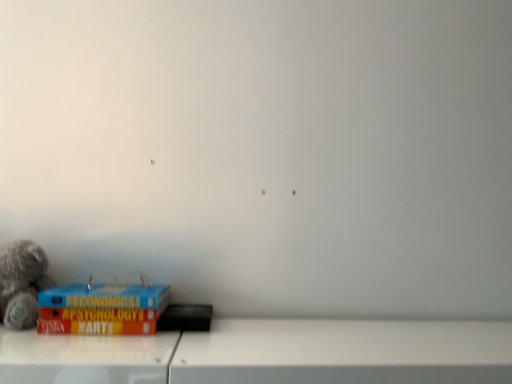
Question: Should I look upward or downward to see fluffy gray teddy bear at left?

Choices:
 (A) down
 (B) up

Answer: (A)

Question: Is fluffy gray teddy bear at left wider than blue hardcover book at lower left?

Choices:
 (A) no
 (B) yes

Answer: (A)

Question: Is fluffy gray teddy bear at left in front of blue hardcover book at lower left?

Choices:
 (A) yes
 (B) no

Answer: (B)

Question: Considering the relative positions of fluffy gray teddy bear at left and blue hardcover book at lower left in the image provided, is fluffy gray teddy bear at left behind blue hardcover book at lower left?

Choices:
 (A) yes
 (B) no

Answer: (A)

Question: Considering the relative sizes of fluffy gray teddy bear at left and blue hardcover book at lower left in the image provided, is fluffy gray teddy bear at left smaller than blue hardcover book at lower left?

Choices:
 (A) yes
 (B) no

Answer: (A)

Question: Considering the relative sizes of fluffy gray teddy bear at left and blue hardcover book at lower left in the image provided, is fluffy gray teddy bear at left shorter than blue hardcover book at lower left?

Choices:
 (A) yes
 (B) no

Answer: (B)

Question: Is fluffy gray teddy bear at left to the right of blue hardcover book at lower left from the viewer's perspective?

Choices:
 (A) no
 (B) yes

Answer: (A)

Question: Is blue hardcover book at lower left completely or partially outside of fluffy gray teddy bear at left?

Choices:
 (A) yes
 (B) no

Answer: (A)

Question: Is fluffy gray teddy bear at left at the back of blue hardcover book at lower left?

Choices:
 (A) no
 (B) yes

Answer: (A)

Question: Considering the relative sizes of blue hardcover book at lower left and fluffy gray teddy bear at left in the image provided, is blue hardcover book at lower left bigger than fluffy gray teddy bear at left?

Choices:
 (A) yes
 (B) no

Answer: (A)

Question: Does blue hardcover book at lower left contain fluffy gray teddy bear at left?

Choices:
 (A) no
 (B) yes

Answer: (A)

Question: Is blue hardcover book at lower left positioned behind fluffy gray teddy bear at left?

Choices:
 (A) no
 (B) yes

Answer: (A)

Question: Considering the relative sizes of blue hardcover book at lower left and fluffy gray teddy bear at left in the image provided, is blue hardcover book at lower left wider than fluffy gray teddy bear at left?

Choices:
 (A) no
 (B) yes

Answer: (B)

Question: Is blue hardcover book at lower left in front of or behind fluffy gray teddy bear at left in the image?

Choices:
 (A) front
 (B) behind

Answer: (A)